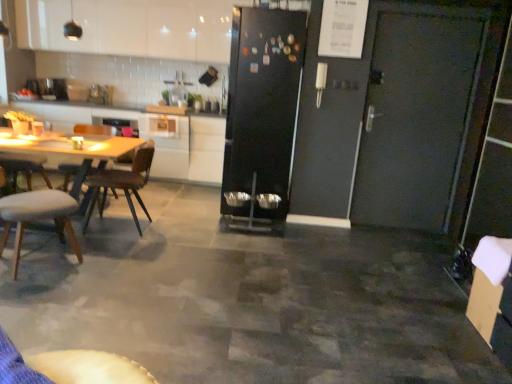
What do you see at coordinates (261, 117) in the screenshot? I see `black matte refrigerator at center` at bounding box center [261, 117].

How much space does white leather chair at left, which ranks as the first chair in front-to-back order, occupy vertically?

white leather chair at left, which ranks as the first chair in front-to-back order, is 30.81 inches in height.

Measure the distance between point (7, 217) and camera.

They are 9.28 feet apart.

From the picture: Measure the distance between point [114,177] and camera.

12.08 feet.

Image resolution: width=512 pixels, height=384 pixels. What do you see at coordinates (167, 144) in the screenshot?
I see `white glossy cabinet at center, which is the 1th cabinetry from bottom to top` at bounding box center [167, 144].

You are a GUI agent. You are given a task and a screenshot of the screen. Output one action in this format:
    pyautogui.click(x=<x>, y=<y>)
    Task: Click on the white glossy countertop at upper left
    This screenshot has width=512, height=384.
    Given the screenshot: What is the action you would take?
    pyautogui.click(x=151, y=137)

Is white leather chair at left, which ranks as the first chair in front-to-back order, to the right of white glossy cabinet at upper left, which appears as the 1th cabinetry when viewed from the top, from the viewer's perspective?

In fact, white leather chair at left, which ranks as the first chair in front-to-back order, is to the left of white glossy cabinet at upper left, which appears as the 1th cabinetry when viewed from the top.

From the image's perspective, does white leather chair at left, the second chair in the back-to-front sequence, appear higher than white glossy cabinet at upper left, which appears as the 1th cabinetry when viewed from the top?

No, from the image's perspective, white leather chair at left, the second chair in the back-to-front sequence, is not over white glossy cabinet at upper left, which appears as the 1th cabinetry when viewed from the top.

Could you measure the distance between white leather chair at left, the second chair in the back-to-front sequence, and white glossy cabinet at upper left, which is counted as the second cabinetry, starting from the bottom?

A distance of 3.35 meters exists between white leather chair at left, the second chair in the back-to-front sequence, and white glossy cabinet at upper left, which is counted as the second cabinetry, starting from the bottom.

Does white leather chair at left, the second chair in the back-to-front sequence, lie in front of white glossy cabinet at upper left, which appears as the 1th cabinetry when viewed from the top?

Yes, it is.

Is black matte refrigerator at center with white glossy cabinet at center, which is the 1th cabinetry from bottom to top?

No, black matte refrigerator at center is not making contact with white glossy cabinet at center, which is the 1th cabinetry from bottom to top.

Which of these two, black matte refrigerator at center or white glossy cabinet at center, which is the 1th cabinetry from bottom to top, is bigger?

black matte refrigerator at center is bigger.

I want to click on refrigerator lying on the right of white glossy cabinet at center, which is the 2th cabinetry in top-to-bottom order, so click(x=261, y=117).

From a real-world perspective, is white glossy cabinet at center, which is the 2th cabinetry in top-to-bottom order, above or below brown wooden chair at left, the 2th chair when ordered from front to back?

white glossy cabinet at center, which is the 2th cabinetry in top-to-bottom order, is above brown wooden chair at left, the 2th chair when ordered from front to back.

Between point (153, 158) and point (87, 218), which one is positioned in front?

The point (87, 218) is in front.

Does white glossy cabinet at center, which is the 1th cabinetry from bottom to top, have a lesser height compared to brown wooden chair at left, the 2th chair when ordered from front to back?

No.

Can you confirm if white glossy cabinet at center, which is the 2th cabinetry in top-to-bottom order, is positioned to the right of brown wooden chair at left, arranged as the 1th chair when viewed from the back?

Yes, white glossy cabinet at center, which is the 2th cabinetry in top-to-bottom order, is to the right of brown wooden chair at left, arranged as the 1th chair when viewed from the back.

From the image's perspective, does white glossy countertop at upper left appear higher than brown wooden chair at left, the 2th chair when ordered from front to back?

Yes, from the image's perspective, white glossy countertop at upper left is over brown wooden chair at left, the 2th chair when ordered from front to back.

Can you confirm if white glossy countertop at upper left is taller than brown wooden chair at left, arranged as the 1th chair when viewed from the back?

Correct, white glossy countertop at upper left is much taller as brown wooden chair at left, arranged as the 1th chair when viewed from the back.

From a real-world perspective, which is physically above, white glossy countertop at upper left or brown wooden chair at left, the 2th chair when ordered from front to back?

white glossy countertop at upper left, from a real-world perspective.

Would you say white glossy countertop at upper left is a long distance from brown wooden chair at left, arranged as the 1th chair when viewed from the back?

Yes, white glossy countertop at upper left is far from brown wooden chair at left, arranged as the 1th chair when viewed from the back.

Is brown wooden chair at left, arranged as the 1th chair when viewed from the back, to the right of black matte refrigerator at center from the viewer's perspective?

No, brown wooden chair at left, arranged as the 1th chair when viewed from the back, is not to the right of black matte refrigerator at center.

Is point (135, 175) closer or farther from the camera than point (264, 232)?

Point (135, 175) is closer to the camera than point (264, 232).

From the image's perspective, does brown wooden chair at left, arranged as the 1th chair when viewed from the back, appear higher than black matte refrigerator at center?

Actually, brown wooden chair at left, arranged as the 1th chair when viewed from the back, appears below black matte refrigerator at center in the image.

Is brown wooden chair at left, arranged as the 1th chair when viewed from the back, positioned with its back to black matte refrigerator at center?

No, brown wooden chair at left, arranged as the 1th chair when viewed from the back, is not facing the opposite direction of black matte refrigerator at center.

Locate an element on the screen. the 1st cabinetry counting from the right of the white leather chair at left, which ranks as the first chair in front-to-back order is located at coordinates (131, 27).

From a real-world perspective, is white glossy cabinet at upper left, which appears as the 1th cabinetry when viewed from the top, on white leather chair at left, which ranks as the first chair in front-to-back order?

Yes, from a real-world perspective, white glossy cabinet at upper left, which appears as the 1th cabinetry when viewed from the top, is over white leather chair at left, which ranks as the first chair in front-to-back order

Between white glossy cabinet at upper left, which is counted as the second cabinetry, starting from the bottom, and white leather chair at left, which ranks as the first chair in front-to-back order, which one is positioned in front?

white leather chair at left, which ranks as the first chair in front-to-back order, is in front.

Would you say white glossy cabinet at upper left, which appears as the 1th cabinetry when viewed from the top, is to the left or to the right of white leather chair at left, which ranks as the first chair in front-to-back order, in the picture?

Based on their positions, white glossy cabinet at upper left, which appears as the 1th cabinetry when viewed from the top, is located to the right of white leather chair at left, which ranks as the first chair in front-to-back order.

How far apart are white glossy cabinet at upper left, which appears as the 1th cabinetry when viewed from the top, and white glossy countertop at upper left?

white glossy cabinet at upper left, which appears as the 1th cabinetry when viewed from the top, is 3.58 feet away from white glossy countertop at upper left.

From the image's perspective, relative to white glossy countertop at upper left, is white glossy cabinet at upper left, which is counted as the second cabinetry, starting from the bottom, above or below?

white glossy cabinet at upper left, which is counted as the second cabinetry, starting from the bottom, is situated higher than white glossy countertop at upper left in the image.

Is there a large distance between white glossy cabinet at upper left, which appears as the 1th cabinetry when viewed from the top, and white glossy countertop at upper left?

Yes, white glossy cabinet at upper left, which appears as the 1th cabinetry when viewed from the top, and white glossy countertop at upper left are located far from each other.

Considering the relative positions of white glossy cabinet at upper left, which is counted as the second cabinetry, starting from the bottom, and white glossy countertop at upper left in the image provided, is white glossy cabinet at upper left, which is counted as the second cabinetry, starting from the bottom, in front of white glossy countertop at upper left?

Yes, white glossy cabinet at upper left, which is counted as the second cabinetry, starting from the bottom, is closer to the viewer.

The height and width of the screenshot is (384, 512). What are the coordinates of `the 1st cabinetry to the right of the white leather chair at left, the second chair in the back-to-front sequence, counting from the anchor's position` in the screenshot? It's located at (131, 27).

There is a white glossy cabinet at center, which is the 1th cabinetry from bottom to top. Identify the location of refrigerator above it (from a real-world perspective). (261, 117).

When comparing their distances from white glossy countertop at upper left, does brown wooden chair at left, arranged as the 1th chair when viewed from the back, or white leather chair at left, the second chair in the back-to-front sequence, seem further?

white leather chair at left, the second chair in the back-to-front sequence, lies further to white glossy countertop at upper left than the other object.

Looking at the image, which one is located further to brown wooden chair at left, arranged as the 1th chair when viewed from the back, black matte refrigerator at center or white glossy cabinet at upper left, which is counted as the second cabinetry, starting from the bottom?

white glossy cabinet at upper left, which is counted as the second cabinetry, starting from the bottom, lies further to brown wooden chair at left, arranged as the 1th chair when viewed from the back, than the other object.

From the image, which object appears to be nearer to brown wooden chair at left, the 2th chair when ordered from front to back, black matte refrigerator at center or white glossy countertop at upper left?

Among the two, black matte refrigerator at center is located nearer to brown wooden chair at left, the 2th chair when ordered from front to back.

From the image, which object appears to be farther from white glossy countertop at upper left, white glossy cabinet at center, which is the 1th cabinetry from bottom to top, or white glossy cabinet at upper left, which is counted as the second cabinetry, starting from the bottom?

white glossy cabinet at upper left, which is counted as the second cabinetry, starting from the bottom, is positioned further to the anchor white glossy countertop at upper left.

When comparing their distances from black matte refrigerator at center, does white glossy cabinet at upper left, which appears as the 1th cabinetry when viewed from the top, or brown wooden chair at left, the 2th chair when ordered from front to back, seem further?

Among the two, white glossy cabinet at upper left, which appears as the 1th cabinetry when viewed from the top, is located further to black matte refrigerator at center.

In the scene shown: Based on their spatial positions, is white glossy cabinet at upper left, which is counted as the second cabinetry, starting from the bottom, or white leather chair at left, the second chair in the back-to-front sequence, closer to black matte refrigerator at center?

Among the two, white leather chair at left, the second chair in the back-to-front sequence, is located nearer to black matte refrigerator at center.

Which object lies further to the anchor point white glossy cabinet at upper left, which is counted as the second cabinetry, starting from the bottom, white glossy countertop at upper left or white leather chair at left, which ranks as the first chair in front-to-back order?

white leather chair at left, which ranks as the first chair in front-to-back order, is positioned further to the anchor white glossy cabinet at upper left, which is counted as the second cabinetry, starting from the bottom.

Looking at the image, which one is located further to white glossy cabinet at upper left, which appears as the 1th cabinetry when viewed from the top, black matte refrigerator at center or white glossy countertop at upper left?

Among the two, black matte refrigerator at center is located further to white glossy cabinet at upper left, which appears as the 1th cabinetry when viewed from the top.

The width and height of the screenshot is (512, 384). I want to click on counter top that lies between white glossy cabinet at upper left, which is counted as the second cabinetry, starting from the bottom, and brown wooden chair at left, arranged as the 1th chair when viewed from the back, from top to bottom, so tap(151, 137).

Where is `cabinetry between white glossy cabinet at upper left, which appears as the 1th cabinetry when viewed from the top, and brown wooden chair at left, arranged as the 1th chair when viewed from the back, in the up-down direction`? The height and width of the screenshot is (384, 512). cabinetry between white glossy cabinet at upper left, which appears as the 1th cabinetry when viewed from the top, and brown wooden chair at left, arranged as the 1th chair when viewed from the back, in the up-down direction is located at coordinates (167, 144).

Identify the location of refrigerator between white glossy cabinet at upper left, which is counted as the second cabinetry, starting from the bottom, and brown wooden chair at left, the 2th chair when ordered from front to back, in the vertical direction. (261, 117).

At what (x,y) coordinates should I click in order to perform the action: click on cabinetry between white leather chair at left, which ranks as the first chair in front-to-back order, and white glossy cabinet at center, which is the 2th cabinetry in top-to-bottom order, from front to back. Please return your answer as a coordinate pair (x, y). This screenshot has height=384, width=512. Looking at the image, I should click on (131, 27).